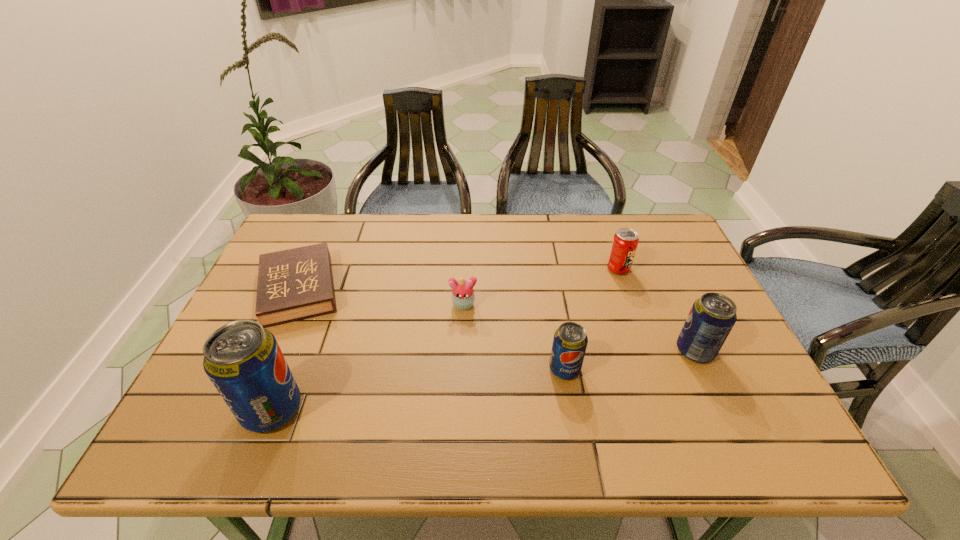
Where is `soda can that is the third closest to the rightmost soda can`? soda can that is the third closest to the rightmost soda can is located at coordinates (243, 360).

Identify the location of soda can that is the third closest to the nearest soda can. (712, 317).

Locate an element on the screen. free space that satisfies the following two spatial constraints: 1. on the face of the third shortest soda can; 2. on the left side of the cupcake is located at coordinates (461, 351).

I want to click on vacant space that satisfies the following two spatial constraints: 1. on the front side of the second soda can from left to right; 2. on the right side of the shortest object, so click(264, 369).

Locate an element on the screen. vacant position in the image that satisfies the following two spatial constraints: 1. on the back side of the second soda can from right to left; 2. on the left side of the hardback book is located at coordinates (308, 269).